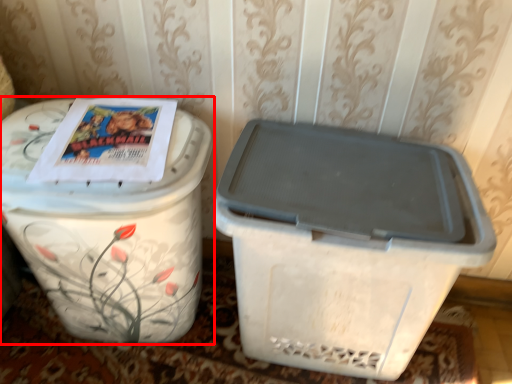
Question: Observing the image, what is the correct spatial positioning of waste container (annotated by the red box) in reference to waste container?

Choices:
 (A) right
 (B) left

Answer: (B)